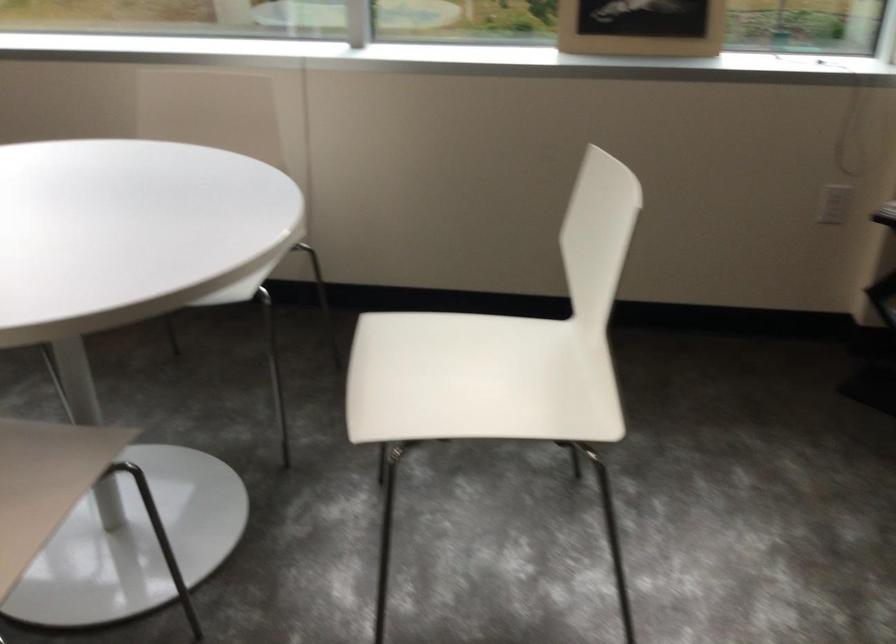
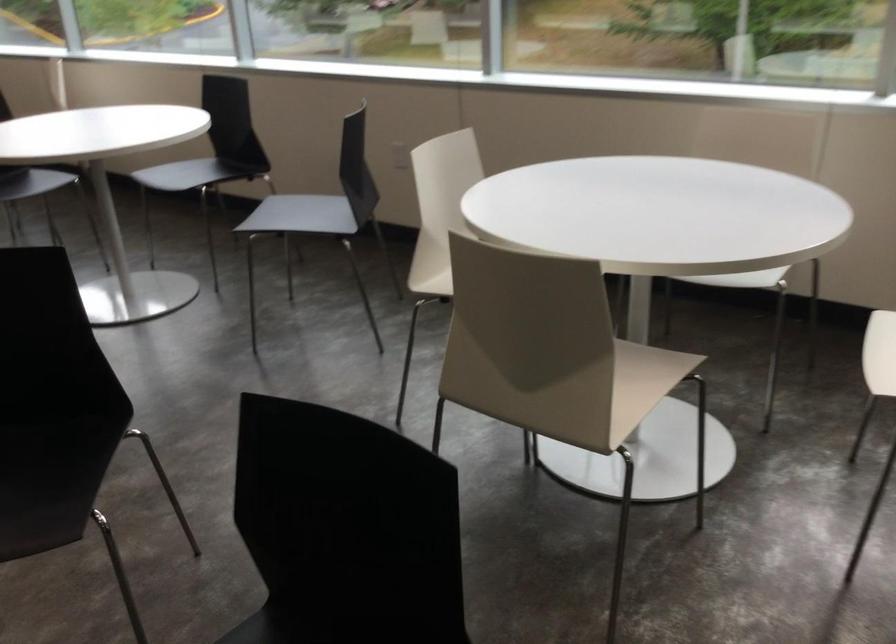
Question: The camera is either moving clockwise (left) or counter-clockwise (right) around the object. The first image is from the beginning of the video and the second image is from the end. Is the camera moving left or right when shooting the video?

Choices:
 (A) Left
 (B) Right

Answer: (B)